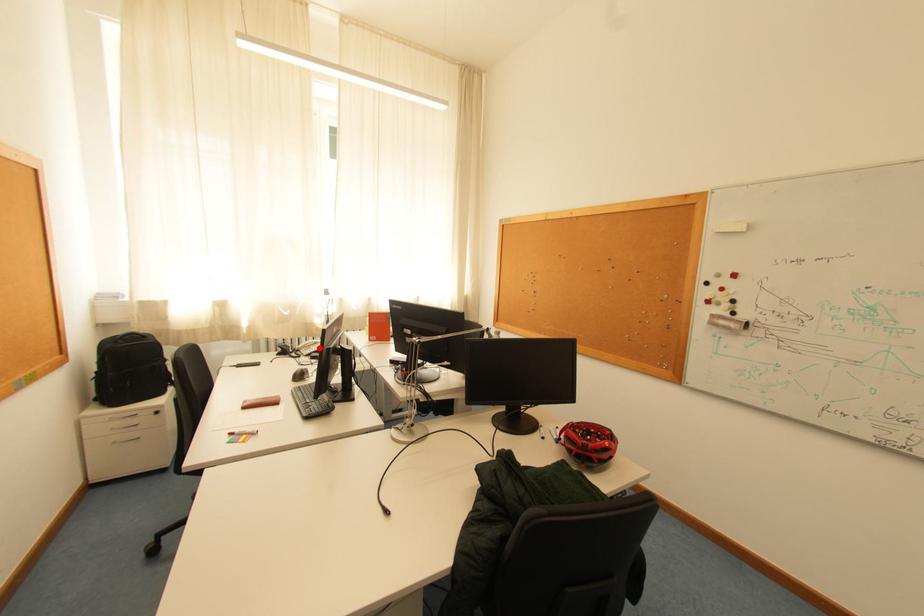
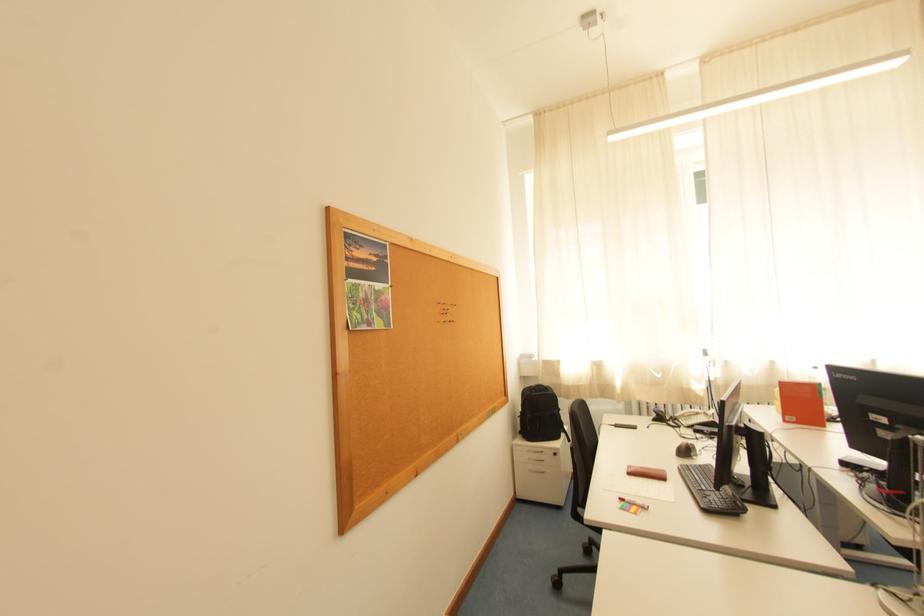
Question: I am providing you with two images of the same scene from different viewpoints. A red point is marked on the first image. At the location where the point appears in image 1, is it still visible in image 2?

Choices:
 (A) Yes
 (B) No

Answer: (A)